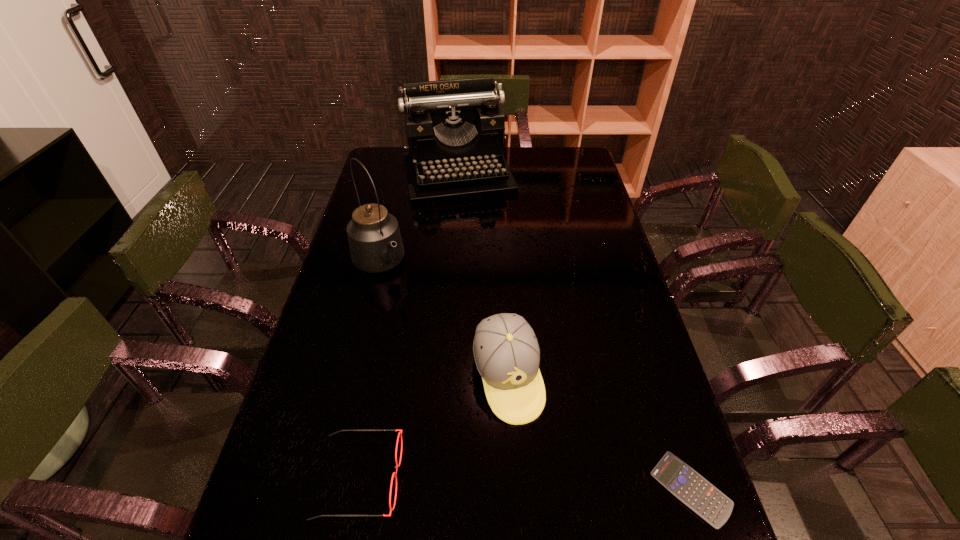
Where is `calculator at the near edge`? This screenshot has height=540, width=960. calculator at the near edge is located at coordinates (687, 485).

Find the location of a particular element. The height and width of the screenshot is (540, 960). spectacles positioned at the left edge is located at coordinates (394, 474).

Image resolution: width=960 pixels, height=540 pixels. I want to click on kettle present at the left edge, so [375, 242].

This screenshot has width=960, height=540. Identify the location of typewriter that is at the left edge. (455, 129).

What are the coordinates of `object that is positioned at the right edge` in the screenshot? It's located at (687, 485).

Find the location of a particular element. The width and height of the screenshot is (960, 540). object present at the far left corner is located at coordinates (455, 129).

This screenshot has width=960, height=540. Find the location of `object present at the near left corner`. object present at the near left corner is located at coordinates (394, 474).

The height and width of the screenshot is (540, 960). I want to click on object present at the near right corner, so click(687, 485).

Locate an element on the screen. This screenshot has height=540, width=960. vacant space at the far edge of the desktop is located at coordinates (524, 161).

Where is `vacant space at the near edge`? This screenshot has height=540, width=960. vacant space at the near edge is located at coordinates (373, 488).